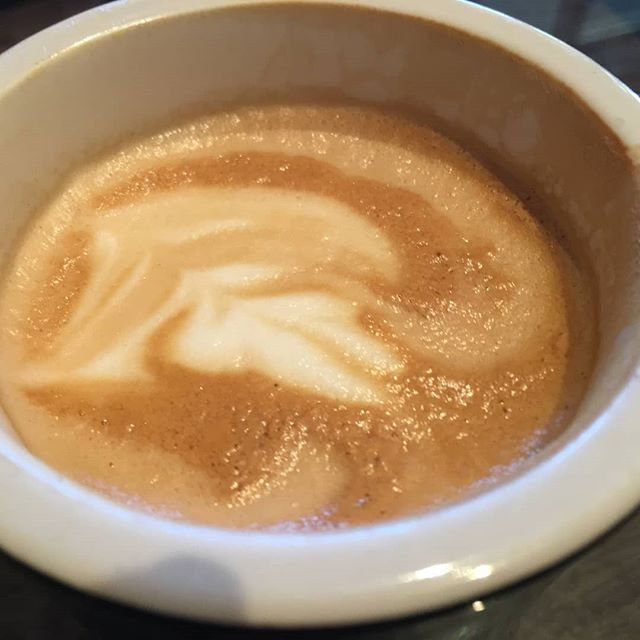
Find the location of a particular element. This screenshot has height=640, width=640. cup is located at coordinates (450, 563), (518, 57), (32, 89).